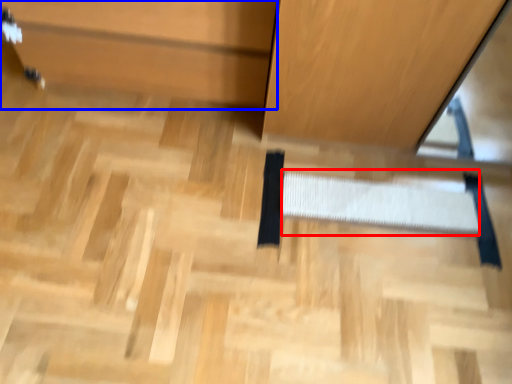
Question: Which of the following is the farthest to the observer, stair (highlighted by a red box) or cabinetry (highlighted by a blue box)?

Choices:
 (A) stair
 (B) cabinetry

Answer: (A)